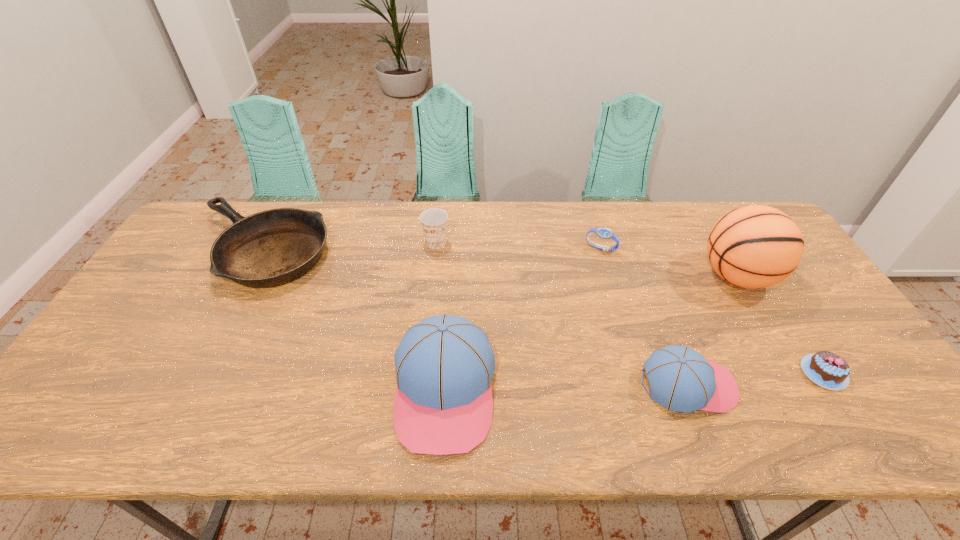
At what (x,y) coordinates should I click in order to perform the action: click on the sixth shortest object. Please return your answer as a coordinate pair (x, y). This screenshot has height=540, width=960. Looking at the image, I should click on (443, 405).

This screenshot has height=540, width=960. I want to click on the left baseball cap, so click(x=443, y=405).

The height and width of the screenshot is (540, 960). In order to click on the right baseball cap in this screenshot , I will do `click(680, 379)`.

Identify the location of watch. (604, 233).

Identify the location of frying pan. (270, 248).

Image resolution: width=960 pixels, height=540 pixels. Identify the location of the tallest object. (755, 246).

The height and width of the screenshot is (540, 960). I want to click on Dixie cup, so tap(434, 221).

I want to click on chocolate cake, so click(x=828, y=370).

Locate an element on the screen. The image size is (960, 540). free space located on the front-facing side of the right baseball cap is located at coordinates (759, 384).

Find the location of `blank area located on the left of the watch`. blank area located on the left of the watch is located at coordinates (487, 248).